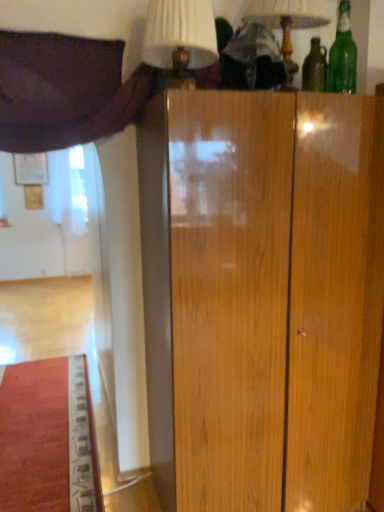
In order to click on matte white lampshade at upper center, arranged as the first table lamp when viewed from the right in this screenshot , I will do `click(284, 25)`.

Locate an element on the screen. The height and width of the screenshot is (512, 384). white fabric lampshade at upper center, which ranks as the 1th table lamp in left-to-right order is located at coordinates (183, 40).

What are the coordinates of `matte white lampshade at upper center, arranged as the first table lamp when viewed from the right` in the screenshot? It's located at point(284,25).

Is green glass bottle at upper right positioned with its back to white fabric lampshade at upper center, which ranks as the 1th table lamp in left-to-right order?

No, green glass bottle at upper right is not facing away from white fabric lampshade at upper center, which ranks as the 1th table lamp in left-to-right order.

Is green glass bottle at upper right wider than white fabric lampshade at upper center, which ranks as the 1th table lamp in left-to-right order?

In fact, green glass bottle at upper right might be narrower than white fabric lampshade at upper center, which ranks as the 1th table lamp in left-to-right order.

Does green glass bottle at upper right have a greater height compared to white fabric lampshade at upper center, the second table lamp positioned from the right?

Yes.

Does green glass bottle at upper right have a smaller size compared to white fabric lampshade at upper center, which ranks as the 1th table lamp in left-to-right order?

Yes, green glass bottle at upper right is smaller than white fabric lampshade at upper center, which ranks as the 1th table lamp in left-to-right order.

Between point (18, 151) and point (284, 58), which one is positioned behind?

The point (18, 151) is behind.

Consider the image. Which of these two, purple fabric curtain at upper left or matte white lampshade at upper center, arranged as the first table lamp when viewed from the right, stands shorter?

With less height is matte white lampshade at upper center, arranged as the first table lamp when viewed from the right.

Are purple fabric curtain at upper left and matte white lampshade at upper center, arranged as the first table lamp when viewed from the right, far apart?

They are positioned close to each other.

Is matte white lampshade at upper center, arranged as the first table lamp when viewed from the right, at the back of purple fabric curtain at upper left?

No, purple fabric curtain at upper left is not facing away from matte white lampshade at upper center, arranged as the first table lamp when viewed from the right.

Is purple fabric curtain at upper left positioned far away from green glass bottle at upper right?

purple fabric curtain at upper left is positioned a significant distance from green glass bottle at upper right.

From the image's perspective, which one is positioned higher, purple fabric curtain at upper left or green glass bottle at upper right?

green glass bottle at upper right appears higher in the image.

Considering the sizes of objects purple fabric curtain at upper left and green glass bottle at upper right in the image provided, who is shorter, purple fabric curtain at upper left or green glass bottle at upper right?

green glass bottle at upper right is shorter.

Would you say purple fabric curtain at upper left is inside or outside green glass bottle at upper right?

purple fabric curtain at upper left lies outside green glass bottle at upper right.

Considering the positions of point (185, 28) and point (57, 95), is point (185, 28) closer or farther from the camera than point (57, 95)?

Clearly, point (185, 28) is closer to the camera than point (57, 95).

Is purple fabric curtain at upper left at the back of white fabric lampshade at upper center, the second table lamp positioned from the right?

Yes, white fabric lampshade at upper center, the second table lamp positioned from the right, is facing away from purple fabric curtain at upper left.

Can you tell me how much white fabric lampshade at upper center, which ranks as the 1th table lamp in left-to-right order, and purple fabric curtain at upper left differ in facing direction?

There is a 1.1-degree angle between the facing directions of white fabric lampshade at upper center, which ranks as the 1th table lamp in left-to-right order, and purple fabric curtain at upper left.

Considering the sizes of white fabric lampshade at upper center, which ranks as the 1th table lamp in left-to-right order, and purple fabric curtain at upper left in the image, is white fabric lampshade at upper center, which ranks as the 1th table lamp in left-to-right order, bigger or smaller than purple fabric curtain at upper left?

white fabric lampshade at upper center, which ranks as the 1th table lamp in left-to-right order, is smaller than purple fabric curtain at upper left.

Could matte white lampshade at upper center, arranged as the first table lamp when viewed from the right, be considered to be inside green glass bottle at upper right?

No, green glass bottle at upper right does not contain matte white lampshade at upper center, arranged as the first table lamp when viewed from the right.

Measure the distance between green glass bottle at upper right and matte white lampshade at upper center, arranged as the first table lamp when viewed from the right.

11.11 inches.

Considering the relative sizes of green glass bottle at upper right and matte white lampshade at upper center, which appears as the second table lamp when viewed from the left, in the image provided, is green glass bottle at upper right shorter than matte white lampshade at upper center, which appears as the second table lamp when viewed from the left,?

Correct, green glass bottle at upper right is not as tall as matte white lampshade at upper center, which appears as the second table lamp when viewed from the left.

Is green glass bottle at upper right further to the viewer compared to matte white lampshade at upper center, which appears as the second table lamp when viewed from the left?

Yes, it is behind matte white lampshade at upper center, which appears as the second table lamp when viewed from the left.

The image size is (384, 512). In order to click on curtain that appears below the green glass bottle at upper right (from the image's perspective) in this screenshot , I will do `click(65, 91)`.

Is green glass bottle at upper right looking in the opposite direction of purple fabric curtain at upper left?

No, purple fabric curtain at upper left is not at the back of green glass bottle at upper right.

Is point (342, 3) in front of point (19, 77)?

No, (342, 3) is further to viewer.

Does green glass bottle at upper right have a lesser width compared to purple fabric curtain at upper left?

Yes, green glass bottle at upper right is thinner than purple fabric curtain at upper left.

Is matte white lampshade at upper center, which appears as the second table lamp when viewed from the left, smaller than white fabric lampshade at upper center, the second table lamp positioned from the right?

Incorrect, matte white lampshade at upper center, which appears as the second table lamp when viewed from the left, is not smaller in size than white fabric lampshade at upper center, the second table lamp positioned from the right.

Which object is closer to the camera, matte white lampshade at upper center, which appears as the second table lamp when viewed from the left, or white fabric lampshade at upper center, which ranks as the 1th table lamp in left-to-right order?

Positioned in front is white fabric lampshade at upper center, which ranks as the 1th table lamp in left-to-right order.

The height and width of the screenshot is (512, 384). Find the location of `table lamp that is in front of the matte white lampshade at upper center, arranged as the first table lamp when viewed from the right`. table lamp that is in front of the matte white lampshade at upper center, arranged as the first table lamp when viewed from the right is located at coordinates (183, 40).

Where is `bottle behind the white fabric lampshade at upper center, which ranks as the 1th table lamp in left-to-right order`? This screenshot has width=384, height=512. bottle behind the white fabric lampshade at upper center, which ranks as the 1th table lamp in left-to-right order is located at coordinates 343,55.

Where is `curtain lying on the left of matte white lampshade at upper center, arranged as the first table lamp when viewed from the right`? curtain lying on the left of matte white lampshade at upper center, arranged as the first table lamp when viewed from the right is located at coordinates (65, 91).

Looking at the image, which one is located further to purple fabric curtain at upper left, white fabric lampshade at upper center, the second table lamp positioned from the right, or matte white lampshade at upper center, which appears as the second table lamp when viewed from the left?

The object further to purple fabric curtain at upper left is matte white lampshade at upper center, which appears as the second table lamp when viewed from the left.

From the image, which object appears to be nearer to white fabric lampshade at upper center, which ranks as the 1th table lamp in left-to-right order, green glass bottle at upper right or purple fabric curtain at upper left?

purple fabric curtain at upper left is closer to white fabric lampshade at upper center, which ranks as the 1th table lamp in left-to-right order.

Which object lies further to the anchor point green glass bottle at upper right, white fabric lampshade at upper center, the second table lamp positioned from the right, or matte white lampshade at upper center, which appears as the second table lamp when viewed from the left?

white fabric lampshade at upper center, the second table lamp positioned from the right, is positioned further to the anchor green glass bottle at upper right.

When comparing their distances from white fabric lampshade at upper center, which ranks as the 1th table lamp in left-to-right order, does purple fabric curtain at upper left or matte white lampshade at upper center, which appears as the second table lamp when viewed from the left, seem further?

matte white lampshade at upper center, which appears as the second table lamp when viewed from the left.

Considering their positions, is green glass bottle at upper right positioned further to matte white lampshade at upper center, arranged as the first table lamp when viewed from the right, than white fabric lampshade at upper center, the second table lamp positioned from the right?

white fabric lampshade at upper center, the second table lamp positioned from the right, is further to matte white lampshade at upper center, arranged as the first table lamp when viewed from the right.

When comparing their distances from purple fabric curtain at upper left, does matte white lampshade at upper center, which appears as the second table lamp when viewed from the left, or white fabric lampshade at upper center, the second table lamp positioned from the right, seem further?

matte white lampshade at upper center, which appears as the second table lamp when viewed from the left, is further to purple fabric curtain at upper left.

Based on their spatial positions, is white fabric lampshade at upper center, which ranks as the 1th table lamp in left-to-right order, or purple fabric curtain at upper left closer to green glass bottle at upper right?

Based on the image, white fabric lampshade at upper center, which ranks as the 1th table lamp in left-to-right order, appears to be nearer to green glass bottle at upper right.

Based on their spatial positions, is matte white lampshade at upper center, which appears as the second table lamp when viewed from the left, or green glass bottle at upper right further from white fabric lampshade at upper center, the second table lamp positioned from the right?

Based on the image, green glass bottle at upper right appears to be further to white fabric lampshade at upper center, the second table lamp positioned from the right.

Locate an element on the screen. The height and width of the screenshot is (512, 384). table lamp between white fabric lampshade at upper center, which ranks as the 1th table lamp in left-to-right order, and green glass bottle at upper right, in the horizontal direction is located at coordinates (284, 25).

Identify the location of table lamp between purple fabric curtain at upper left and matte white lampshade at upper center, arranged as the first table lamp when viewed from the right, from left to right. This screenshot has height=512, width=384. (183, 40).